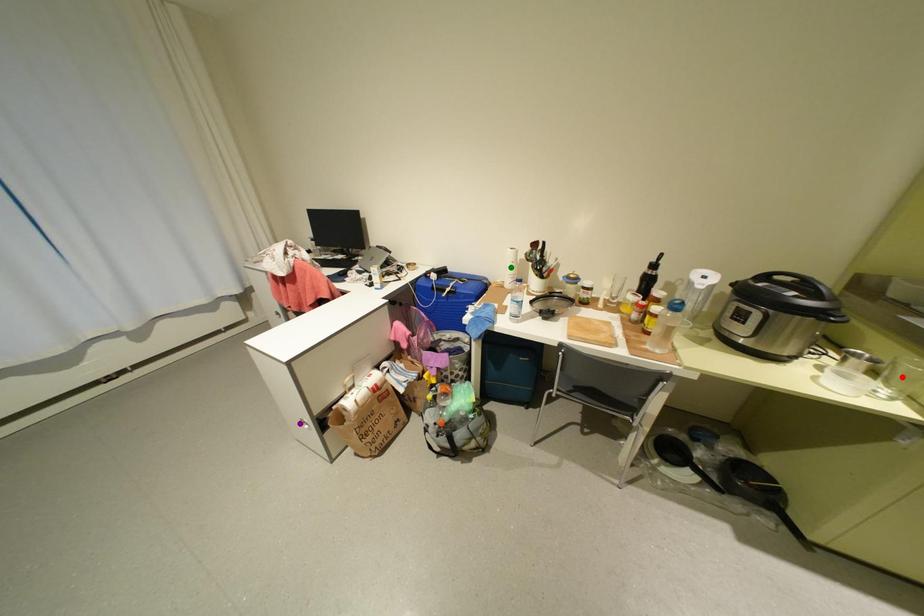
Order these from nearest to farthest:
1. red point
2. green point
3. purple point

1. green point
2. purple point
3. red point